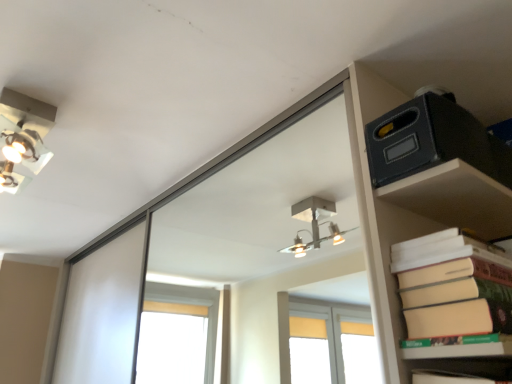
Question: Does matte black box at upper right have a greater width compared to metallic silver light fixture at upper left?

Choices:
 (A) no
 (B) yes

Answer: (A)

Question: From the image's perspective, is matte black box at upper right over metallic silver light fixture at upper left?

Choices:
 (A) no
 (B) yes

Answer: (A)

Question: Is matte black box at upper right outside metallic silver light fixture at upper left?

Choices:
 (A) no
 (B) yes

Answer: (B)

Question: Does matte black box at upper right have a greater height compared to metallic silver light fixture at upper left?

Choices:
 (A) yes
 (B) no

Answer: (B)

Question: Is matte black box at upper right not close to metallic silver light fixture at upper left?

Choices:
 (A) no
 (B) yes

Answer: (A)

Question: Is matte black box at upper right shorter than metallic silver light fixture at upper left?

Choices:
 (A) yes
 (B) no

Answer: (A)

Question: Could you tell me if metallic silver light fixture at upper left is turned towards matte black box at upper right?

Choices:
 (A) yes
 (B) no

Answer: (B)

Question: Does metallic silver light fixture at upper left appear on the right side of matte black box at upper right?

Choices:
 (A) no
 (B) yes

Answer: (A)

Question: Can you see metallic silver light fixture at upper left touching matte black box at upper right?

Choices:
 (A) yes
 (B) no

Answer: (B)

Question: Does metallic silver light fixture at upper left appear on the left side of matte black box at upper right?

Choices:
 (A) no
 (B) yes

Answer: (B)

Question: From a real-world perspective, does metallic silver light fixture at upper left stand above matte black box at upper right?

Choices:
 (A) yes
 (B) no

Answer: (A)

Question: Is metallic silver light fixture at upper left shorter than matte black box at upper right?

Choices:
 (A) yes
 (B) no

Answer: (B)

Question: Is beige matte paper at right bigger than matte black box at upper right?

Choices:
 (A) yes
 (B) no

Answer: (A)